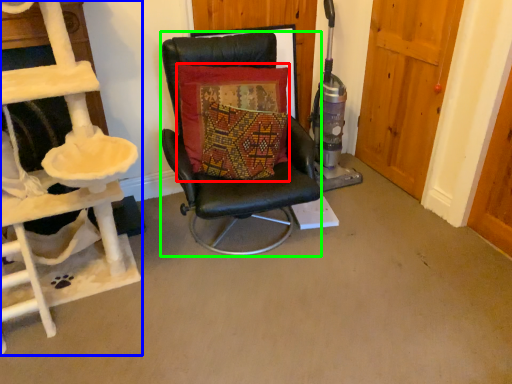
Question: Which object is positioned farthest from pillow (highlighted by a red box)? Select from ladder (highlighted by a blue box) and chair (highlighted by a green box).

Choices:
 (A) ladder
 (B) chair

Answer: (A)